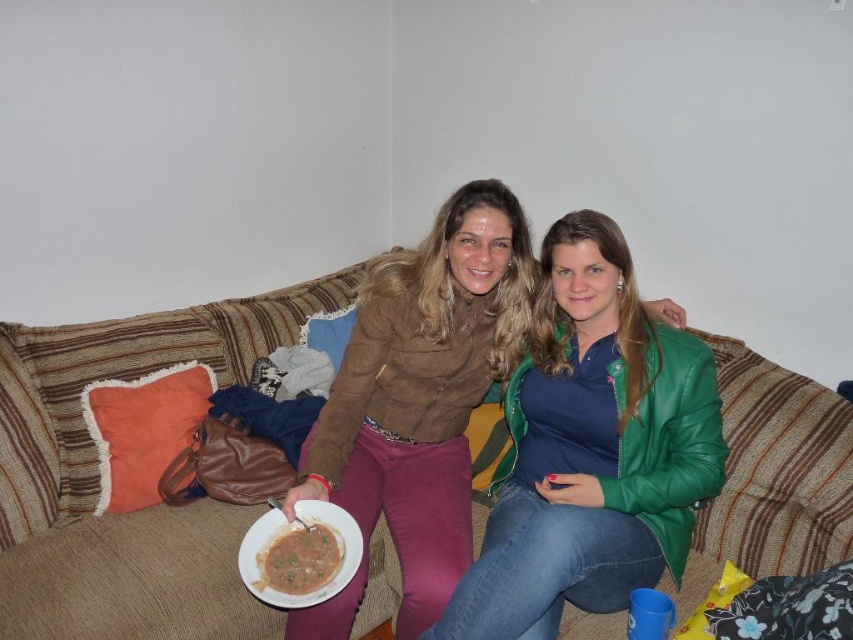
You are standing in front of a couch with several cushions. There is a point marked at coordinates (97, 476). Based on the scene description, where is this point located?

The point is located on the brown fabric couch at center.

You have a small decorative item that is 10 cm in width. You want to place it on the brown fabric couch at center so that it doesn t fall off. Considering the size of the brown matte bowl at center, which is also on the couch, is there enough space for the item?

The brown matte bowl at center is smaller than the brown fabric couch at center. Since the couch is wider than the bowl, there should be enough space to place the 10 cm decorative item without it falling off.

You are standing in the living room and want to sit on the brown fabric couch at center. Based on the coordinates provided, can you confirm if the point marked at (97, 476) is the correct location for the couch?

Yes, the point marked at (97, 476) corresponds to the brown fabric couch at center as stated in the objects description.